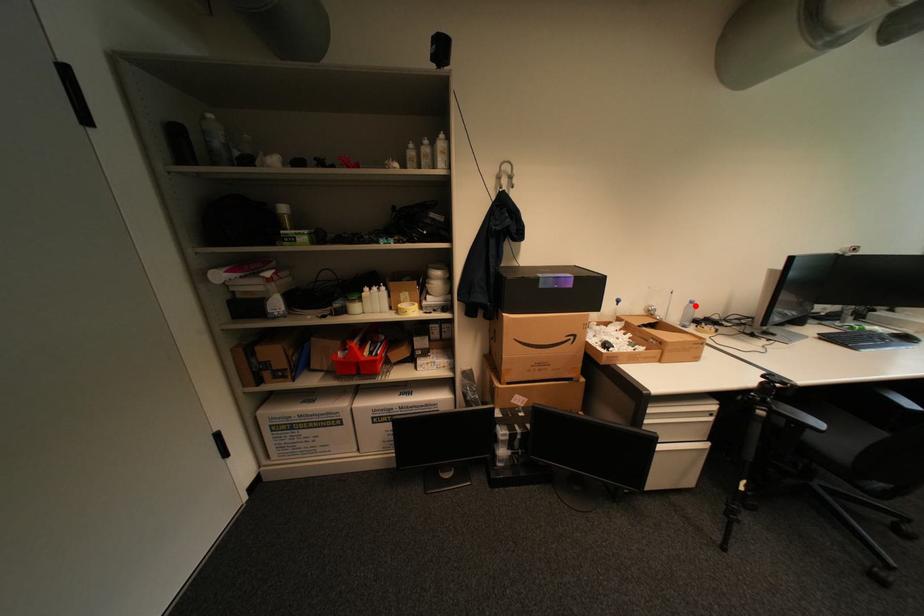
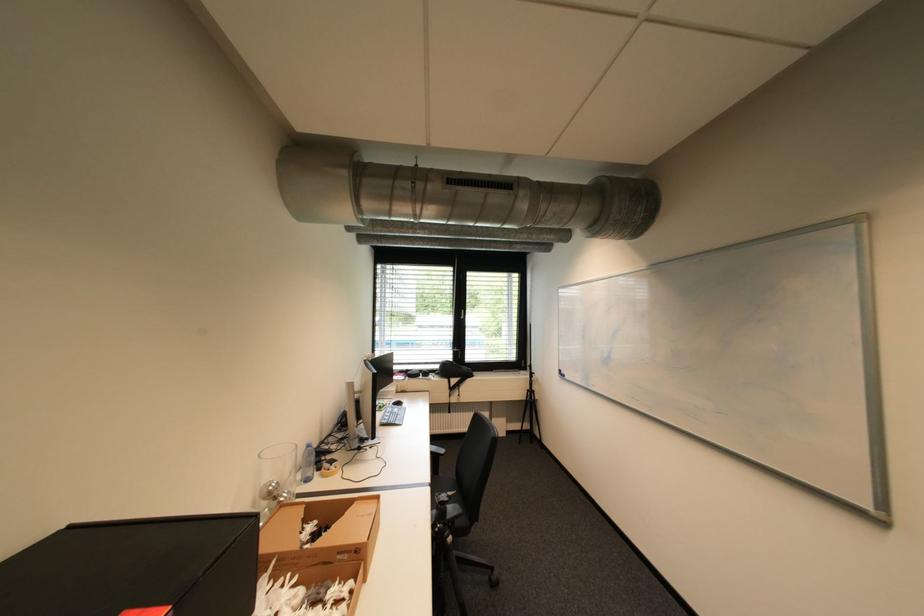
Question: A red point is marked in image1. In image2, is the corresponding 3D point closer to the camera or farther? Reply with the corresponding letter.

Choices:
 (A) The corresponding 3D point is closer.
 (B) The corresponding 3D point is farther.

Answer: (A)